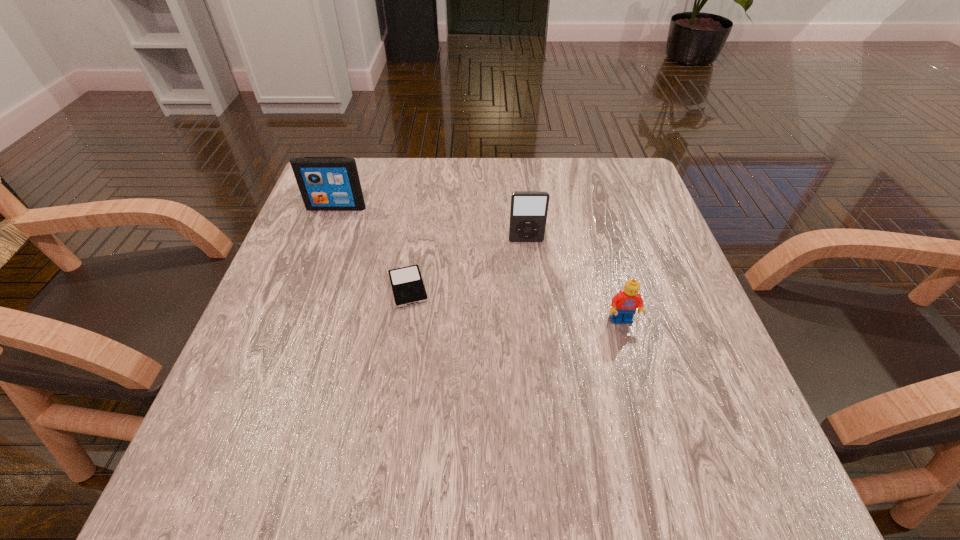
This screenshot has width=960, height=540. I want to click on vacant space situated on the face of the nearest object, so click(641, 393).

Locate an element on the screen. vacant space located on the right of the second object from left to right is located at coordinates (571, 287).

The width and height of the screenshot is (960, 540). I want to click on object that is at the far edge, so click(x=326, y=183).

This screenshot has height=540, width=960. I want to click on object that is positioned at the left edge, so click(x=326, y=183).

Locate an element on the screen. This screenshot has width=960, height=540. object that is at the right edge is located at coordinates (624, 304).

I want to click on object situated at the far left corner, so click(326, 183).

Image resolution: width=960 pixels, height=540 pixels. In the image, there is a desktop. Find the location of `vacant space at the far edge`. vacant space at the far edge is located at coordinates (438, 165).

Locate an element on the screen. vacant space at the near edge of the desktop is located at coordinates (324, 485).

This screenshot has width=960, height=540. Find the location of `vacant region at the left edge of the desktop`. vacant region at the left edge of the desktop is located at coordinates (302, 372).

In the image, there is a desktop. Find the location of `free space at the right edge`. free space at the right edge is located at coordinates (722, 373).